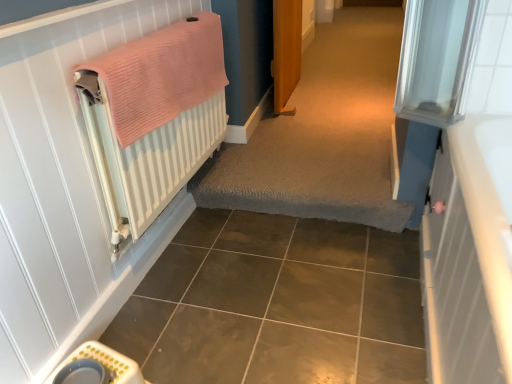
Question: Does white textured radiator at left have a larger size compared to pink knitted towel at left?

Choices:
 (A) yes
 (B) no

Answer: (A)

Question: From a real-world perspective, is white textured radiator at left located beneath pink knitted towel at left?

Choices:
 (A) no
 (B) yes

Answer: (B)

Question: Does white textured radiator at left touch pink knitted towel at left?

Choices:
 (A) yes
 (B) no

Answer: (B)

Question: Considering the relative sizes of white textured radiator at left and pink knitted towel at left in the image provided, is white textured radiator at left taller than pink knitted towel at left?

Choices:
 (A) no
 (B) yes

Answer: (B)

Question: Is white textured radiator at left wider than pink knitted towel at left?

Choices:
 (A) no
 (B) yes

Answer: (B)

Question: Considering their positions, is brown glossy ceramic tile at lower center located in front of or behind textured carpet at center?

Choices:
 (A) behind
 (B) front

Answer: (B)

Question: Does point [266, 225] appear closer or farther from the camera than point [197, 188]?

Choices:
 (A) farther
 (B) closer

Answer: (B)

Question: Would you say brown glossy ceramic tile at lower center is inside or outside textured carpet at center?

Choices:
 (A) inside
 (B) outside

Answer: (B)

Question: From their relative heights in the image, would you say brown glossy ceramic tile at lower center is taller or shorter than textured carpet at center?

Choices:
 (A) tall
 (B) short

Answer: (A)

Question: Is textured carpet at center inside or outside of brown glossy ceramic tile at lower center?

Choices:
 (A) outside
 (B) inside

Answer: (A)

Question: Looking at the image, does textured carpet at center seem bigger or smaller compared to brown glossy ceramic tile at lower center?

Choices:
 (A) big
 (B) small

Answer: (A)

Question: Looking at their shapes, would you say textured carpet at center is wider or thinner than brown glossy ceramic tile at lower center?

Choices:
 (A) thin
 (B) wide

Answer: (B)

Question: Is point (322, 127) closer or farther from the camera than point (204, 364)?

Choices:
 (A) closer
 (B) farther

Answer: (B)

Question: In the image, is pink knitted towel at left on the left side or the right side of white textured radiator at left?

Choices:
 (A) left
 (B) right

Answer: (B)

Question: Does point (130, 87) appear closer or farther from the camera than point (87, 129)?

Choices:
 (A) farther
 (B) closer

Answer: (B)